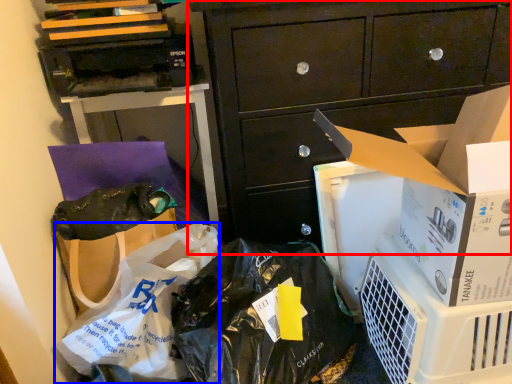
Question: Which point is closer to the camera, cabinetry (highlighted by a red box) or plastic bag (highlighted by a blue box)?

Choices:
 (A) cabinetry
 (B) plastic bag

Answer: (B)